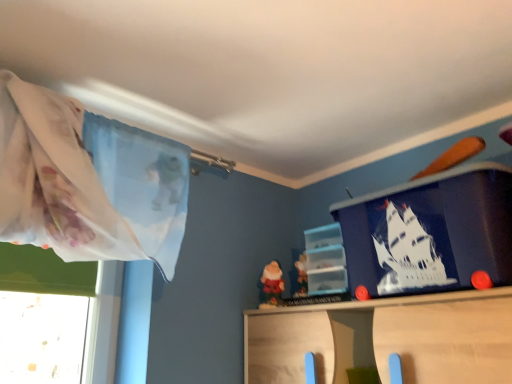
Question: Is translucent plastic shelf at center to the right of blue matte plastic container at upper right from the viewer's perspective?

Choices:
 (A) yes
 (B) no

Answer: (B)

Question: Considering the relative sizes of translucent plastic shelf at center and blue matte plastic container at upper right in the image provided, is translucent plastic shelf at center thinner than blue matte plastic container at upper right?

Choices:
 (A) no
 (B) yes

Answer: (B)

Question: Is translucent plastic shelf at center located outside blue matte plastic container at upper right?

Choices:
 (A) no
 (B) yes

Answer: (B)

Question: Does translucent plastic shelf at center contain blue matte plastic container at upper right?

Choices:
 (A) yes
 (B) no

Answer: (B)

Question: Can you confirm if translucent plastic shelf at center is positioned to the left of blue matte plastic container at upper right?

Choices:
 (A) yes
 (B) no

Answer: (A)

Question: From the image's perspective, would you say translucent plastic shelf at center is shown under blue matte plastic container at upper right?

Choices:
 (A) yes
 (B) no

Answer: (A)

Question: Considering the relative sizes of blue matte plastic container at upper right and translucent plastic shelf at center in the image provided, is blue matte plastic container at upper right wider than translucent plastic shelf at center?

Choices:
 (A) yes
 (B) no

Answer: (A)

Question: Are blue matte plastic container at upper right and translucent plastic shelf at center located far from each other?

Choices:
 (A) yes
 (B) no

Answer: (B)

Question: Is blue matte plastic container at upper right closer to camera compared to translucent plastic shelf at center?

Choices:
 (A) no
 (B) yes

Answer: (B)

Question: Is blue matte plastic container at upper right looking in the opposite direction of translucent plastic shelf at center?

Choices:
 (A) no
 (B) yes

Answer: (A)

Question: From a real-world perspective, is blue matte plastic container at upper right over translucent plastic shelf at center?

Choices:
 (A) no
 (B) yes

Answer: (B)

Question: Considering the relative sizes of blue matte plastic container at upper right and translucent plastic shelf at center in the image provided, is blue matte plastic container at upper right smaller than translucent plastic shelf at center?

Choices:
 (A) yes
 (B) no

Answer: (B)

Question: Considering the positions of translucent plastic shelf at center and blue matte plastic container at upper right in the image, is translucent plastic shelf at center bigger or smaller than blue matte plastic container at upper right?

Choices:
 (A) small
 (B) big

Answer: (A)